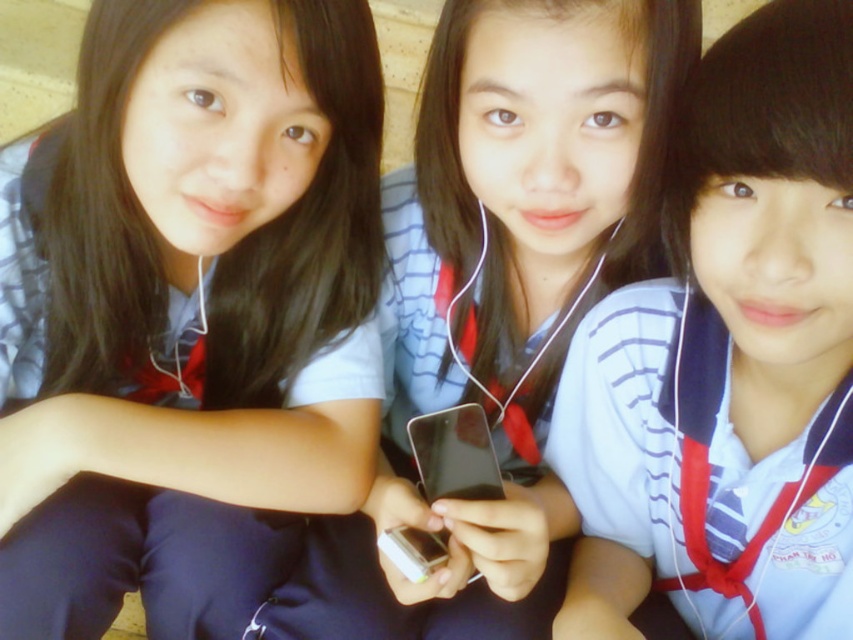
You are a photographer trying to capture a group photo of the three students. You notice the matte blue uniform at center and the matte black phone at center. Which object takes up more area in the photo?

The matte black phone at center takes up more area in the photo than the matte blue uniform at center because the matte blue uniform at center occupies less space than matte black phone at center.

You are a student who wants to place a notebook between the matte black phone at center and the black glossy smartphone at center. The notebook is 15 centimeters wide. Can you fit it between them?

The distance between the matte black phone at center and the black glossy smartphone at center is 17.66 centimeters. Since the notebook is 15 centimeters wide, it can fit between them with some space remaining.

You are a photographer trying to capture a closeup of the blue striped shirt at center and the black glossy smartphone at center. Since you can only focus on one object at a time, which one should you focus on first if you want to ensure both are in focus without moving the camera?

The blue striped shirt at center is above the black glossy smartphone at center, so you should focus on the blue striped shirt at center first since it is closer to the camera.